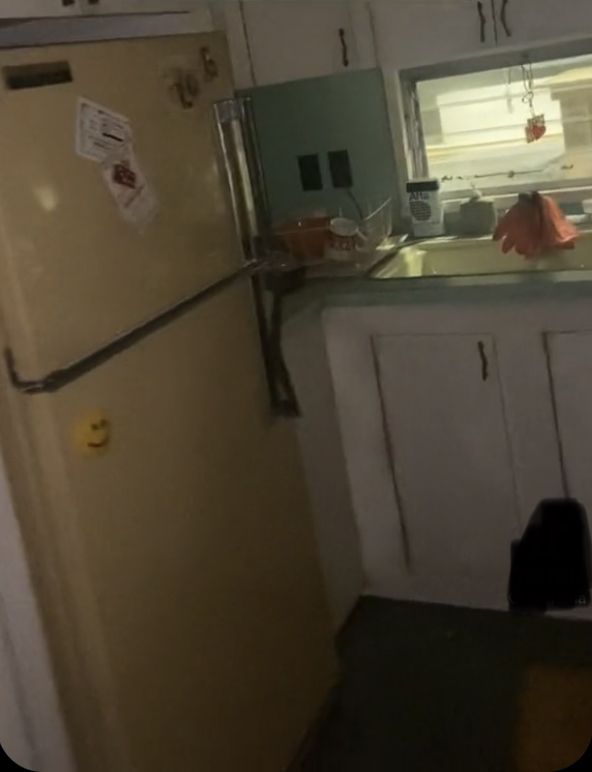
I want to click on coffee cup, so click(352, 249).